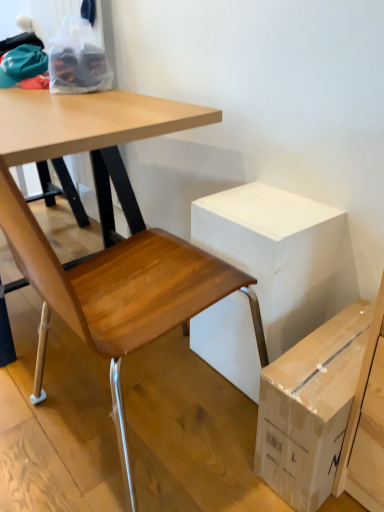
Find the location of a particular element. The image size is (384, 512). vacant space underneath wooden chair at lower left (from a real-world perspective) is located at coordinates (135, 419).